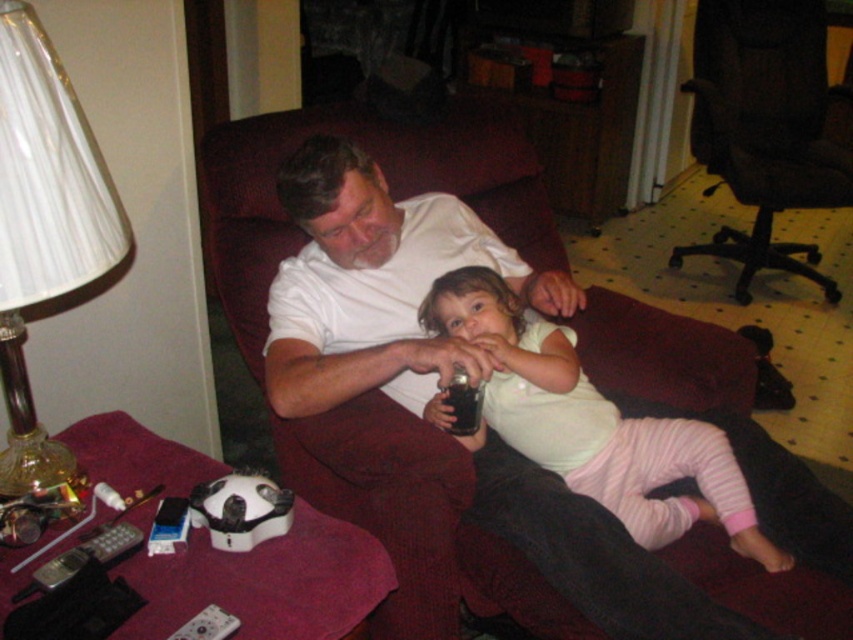
You are a person who is 1.7 meters tall. You are sitting on the maroon fabric couch at center and want to reach the white pleated lampshade at left. Can you comfortably reach it without standing up?

The maroon fabric couch at center is much taller than the white pleated lampshade at left, so you would have to lean forward or adjust your position to reach it comfortably while sitting.

Looking at this image, you are a person standing at the point marked by the coordinates point (590,422). You want to hand a gift to the adult male wearing a white T shirt and dark pants sitting on the maroon sofa. Which direction should you move to reach him?

The adult male wearing a white T shirt and dark pants is located at the maroon sofa, which is to the left of the point 0.661, 094. Therefore, you should move to the left to reach him.

From the picture: What is located at the coordinates point (590, 422) in the image?

The white cotton shirt at upper center is located at point (590, 422).